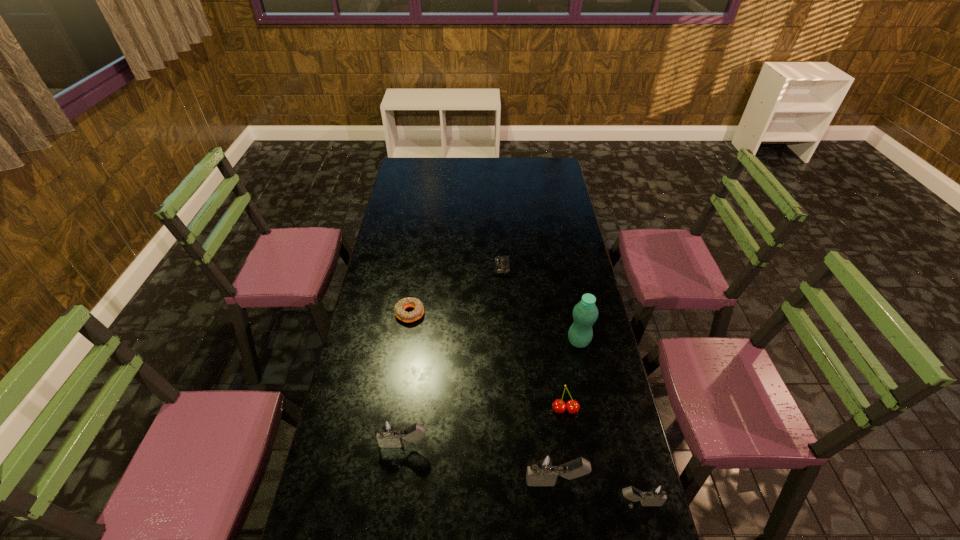
Locate an element on the screen. vacant space that satisfies the following two spatial constraints: 1. at the front cap of the third farthest object; 2. on the back side of the shortest igniter is located at coordinates (612, 503).

Image resolution: width=960 pixels, height=540 pixels. Find the location of `vacant space that satisfies the following two spatial constraints: 1. on the display of the rightmost igniter; 2. on the left side of the farthest object`. vacant space that satisfies the following two spatial constraints: 1. on the display of the rightmost igniter; 2. on the left side of the farthest object is located at coordinates (514, 503).

Where is `free location that satisfies the following two spatial constraints: 1. on the display of the rightmost igniter; 2. on the left side of the alarm clock`? free location that satisfies the following two spatial constraints: 1. on the display of the rightmost igniter; 2. on the left side of the alarm clock is located at coordinates (514, 503).

This screenshot has width=960, height=540. I want to click on vacant space that satisfies the following two spatial constraints: 1. at the front cap of the tallest object; 2. with the stems of the cherry pointing upwards, so click(592, 410).

I want to click on free space that satisfies the following two spatial constraints: 1. on the display of the second igniter from left to right; 2. on the left side of the farthest object, so click(513, 482).

This screenshot has width=960, height=540. Identify the location of free space that satisfies the following two spatial constraints: 1. on the display of the shortest object; 2. on the front side of the leftmost igniter. (511, 444).